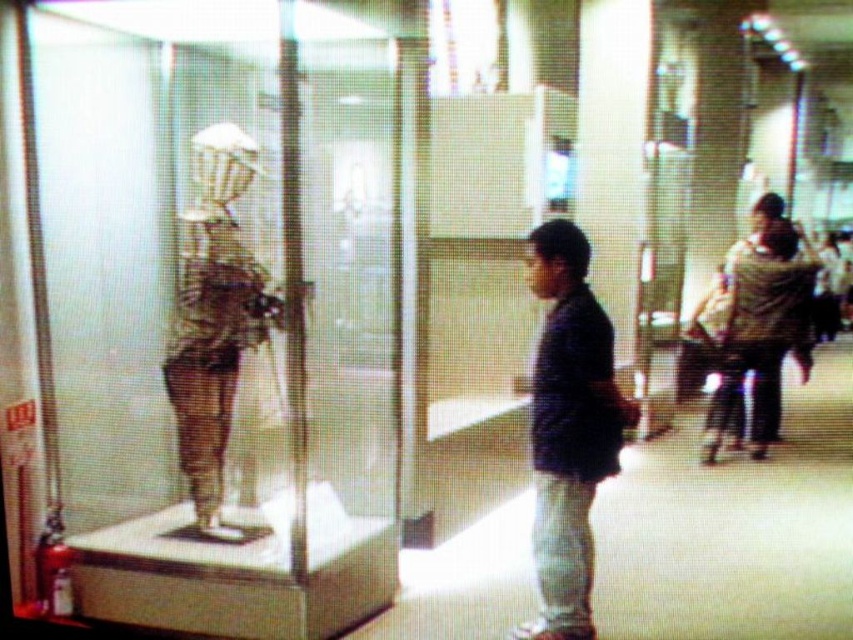
Describe the element at coordinates (215, 321) in the screenshot. This screenshot has height=640, width=853. I see `brown wooden skeleton at center` at that location.

Who is positioned more to the left, brown wooden skeleton at center or brown textured jacket at right?

brown wooden skeleton at center is more to the left.

This screenshot has height=640, width=853. What are the coordinates of `brown wooden skeleton at center` in the screenshot? It's located at (215, 321).

Image resolution: width=853 pixels, height=640 pixels. I want to click on brown wooden skeleton at center, so click(x=215, y=321).

Between dark blue shirt at center and brown textured jacket at right, which one is positioned lower?

Positioned lower is dark blue shirt at center.

Can you confirm if dark blue shirt at center is taller than brown textured jacket at right?

Correct, dark blue shirt at center is much taller as brown textured jacket at right.

Measure the distance between point (x=550, y=465) and camera.

A distance of 3.23 meters exists between point (x=550, y=465) and camera.

You are a GUI agent. You are given a task and a screenshot of the screen. Output one action in this format:
    pyautogui.click(x=<x>, y=<y>)
    Task: Click on the dark blue shirt at center
    
    Given the screenshot: What is the action you would take?
    pyautogui.click(x=569, y=428)

Is dark blue shirt at center above brown wooden skeleton at center?

Incorrect, dark blue shirt at center is not positioned above brown wooden skeleton at center.

Who is positioned more to the left, dark blue shirt at center or brown wooden skeleton at center?

Positioned to the left is brown wooden skeleton at center.

Is point (564, 321) positioned before point (195, 433)?

That is True.

Locate an element on the screen. The width and height of the screenshot is (853, 640). dark blue shirt at center is located at coordinates pyautogui.click(x=569, y=428).